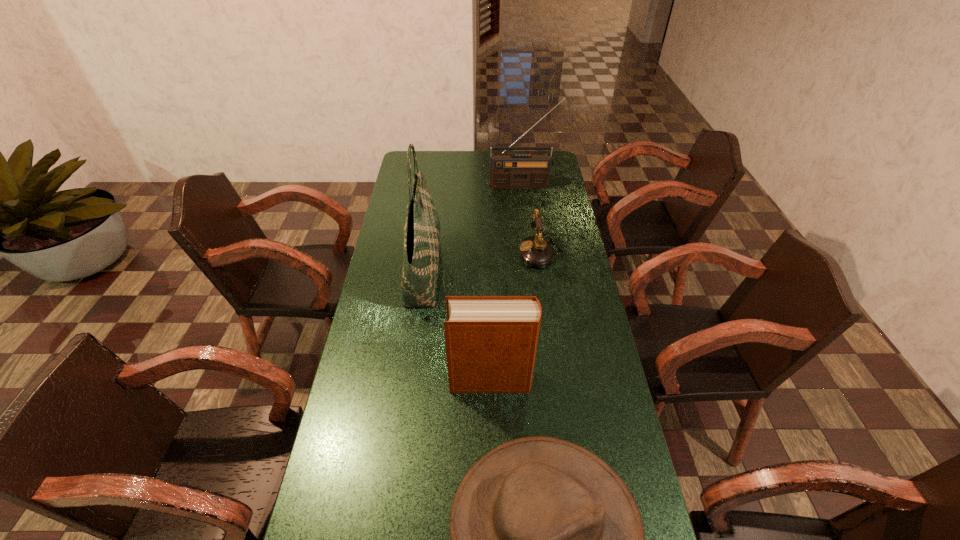
I want to click on blank space located 0.250m on the open cover of the hardback book, so click(369, 380).

Find the location of `free region located 0.290m on the open cover of the hardback book`. free region located 0.290m on the open cover of the hardback book is located at coordinates (356, 380).

In order to click on vacant space located 0.130m on the dial of the fourth tallest object in this screenshot , I will do `click(487, 252)`.

Locate an element on the screen. The width and height of the screenshot is (960, 540). vacant position located on the dial of the fourth tallest object is located at coordinates (433, 252).

Locate an element on the screen. Image resolution: width=960 pixels, height=540 pixels. vacant space situated 0.220m on the dial of the fourth tallest object is located at coordinates (465, 252).

Where is `object at the left edge`? The width and height of the screenshot is (960, 540). object at the left edge is located at coordinates (422, 226).

The image size is (960, 540). I want to click on radio receiver at the right edge, so click(x=507, y=171).

The image size is (960, 540). I want to click on telephone that is positioned at the right edge, so click(x=535, y=251).

This screenshot has width=960, height=540. I want to click on free space at the far edge, so click(x=461, y=170).

In order to click on blank space at the left edge in this screenshot , I will do `click(393, 260)`.